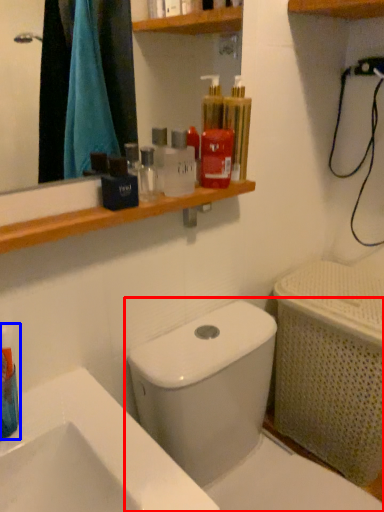
Question: Which object is closer to the camera taking this photo, toilet (highlighted by a red box) or mouthwash (highlighted by a blue box)?

Choices:
 (A) toilet
 (B) mouthwash

Answer: (A)